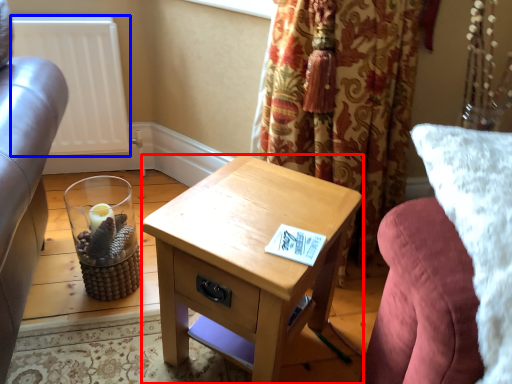
Question: Which object is further to the camera taking this photo, nightstand (highlighted by a red box) or radiator (highlighted by a blue box)?

Choices:
 (A) nightstand
 (B) radiator

Answer: (B)